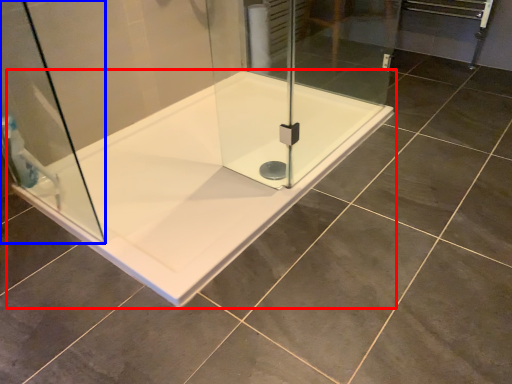
Question: Which of the following is the closest to the observer, bathtub (highlighted by a red box) or shower door (highlighted by a blue box)?

Choices:
 (A) bathtub
 (B) shower door

Answer: (B)